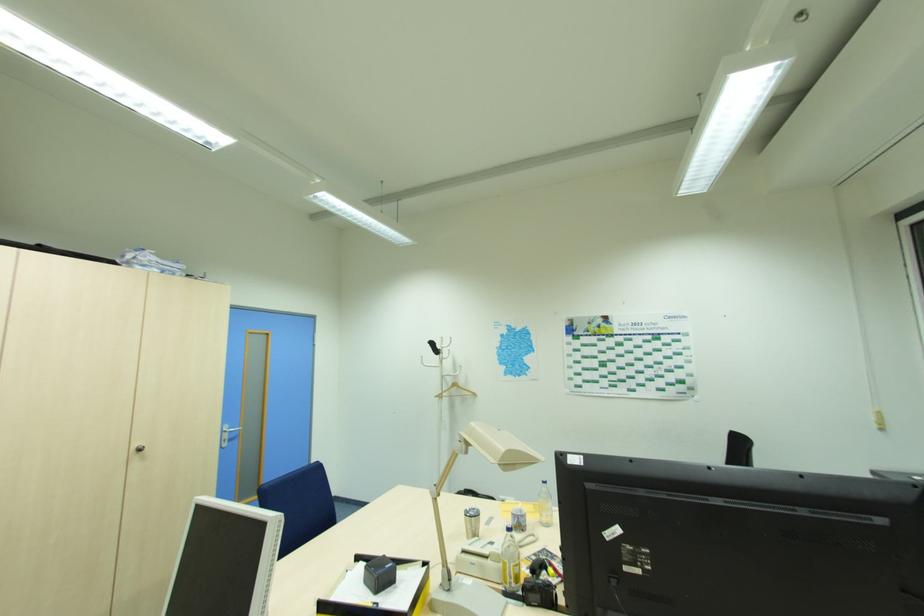
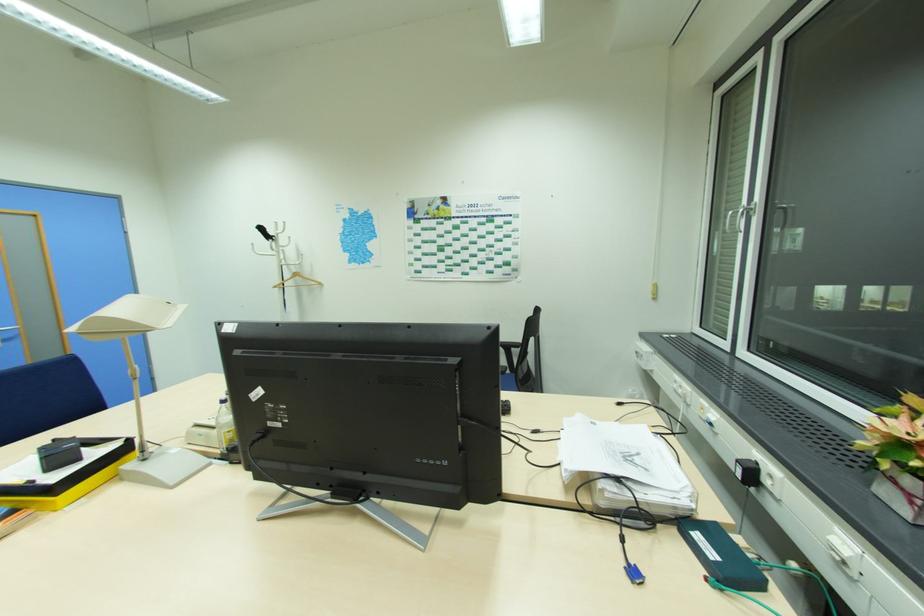
In the second image, find the point that corresponds to the point at 489,557 in the first image.

(216, 428)